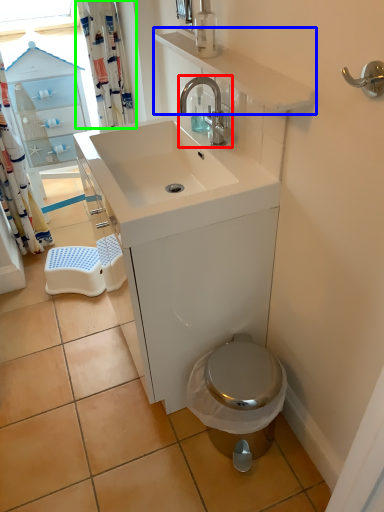
Question: Which is nearer to the tap (highlighted by a red box)? counter top (highlighted by a blue box) or shower curtain (highlighted by a green box).

Choices:
 (A) counter top
 (B) shower curtain

Answer: (A)